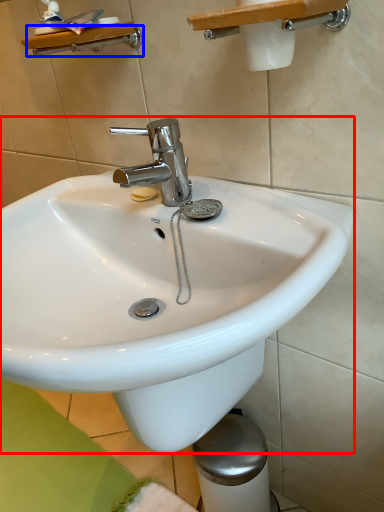
Question: Which object is closer to the camera taking this photo, sink (highlighted by a red box) or shower (highlighted by a blue box)?

Choices:
 (A) sink
 (B) shower

Answer: (A)